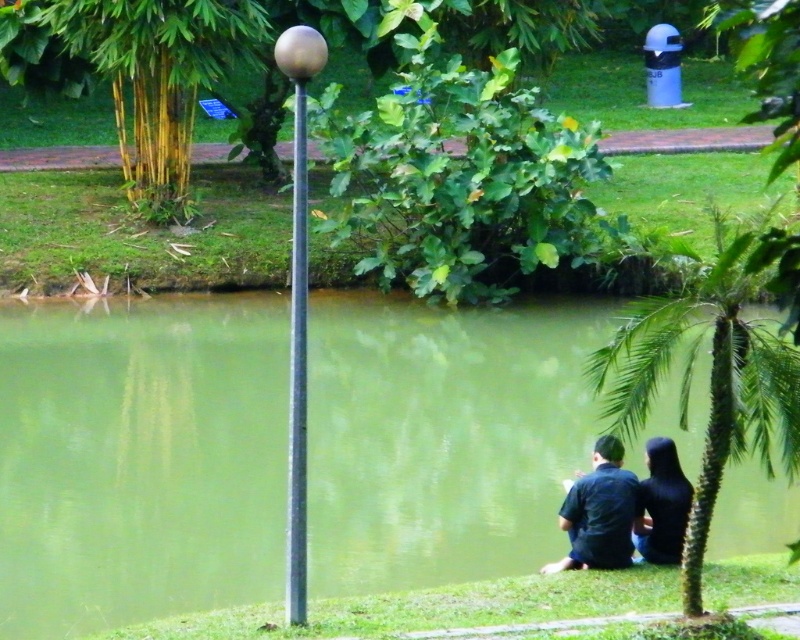
Does point (304, 509) come behind point (288, 576)?

No, (304, 509) is in front of (288, 576).

Which is more to the left, gold metallic sphere at upper center or silver metallic pole at center?

silver metallic pole at center

Is point (322, 48) farther from viewer compared to point (304, 365)?

No, it is in front of (304, 365).

Image resolution: width=800 pixels, height=640 pixels. What are the coordinates of `gold metallic sphere at upper center` in the screenshot? It's located at (298, 308).

How distant is green water at center from dark blue shirt at lower center?

The distance of green water at center from dark blue shirt at lower center is 4.46 meters.

Who is more distant from viewer, (102, 540) or (604, 515)?

The point (102, 540) is more distant.

Describe the element at coordinates (140, 458) in the screenshot. The width and height of the screenshot is (800, 640). I see `green water at center` at that location.

The height and width of the screenshot is (640, 800). In order to click on green water at center in this screenshot , I will do `click(140, 458)`.

Is silver metallic pole at center further to the viewer compared to dark blue fabric dress at lower right?

No, it is not.

From the picture: Can you confirm if silver metallic pole at center is bigger than dark blue fabric dress at lower right?

No, silver metallic pole at center is not bigger than dark blue fabric dress at lower right.

Measure the distance between silver metallic pole at center and camera.

A distance of 28.63 feet exists between silver metallic pole at center and camera.

Find the location of a particular element. silver metallic pole at center is located at coordinates (297, 374).